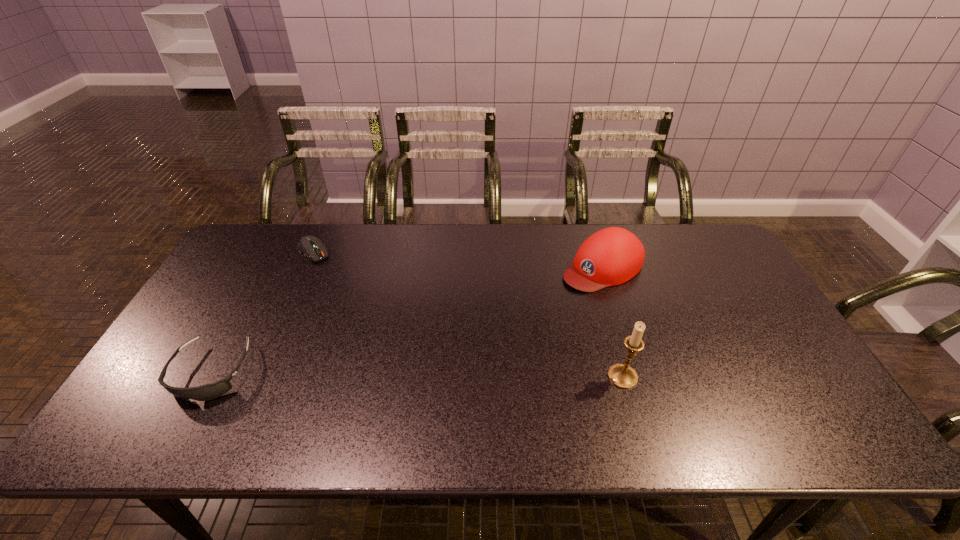
Identify the location of free space at the right edge. The image size is (960, 540). (776, 323).

The width and height of the screenshot is (960, 540). I want to click on free location at the far left corner, so click(255, 258).

Identify the location of vacant space at the near left corner of the desktop. (202, 379).

You are a GUI agent. You are given a task and a screenshot of the screen. Output one action in this format:
    pyautogui.click(x=<x>, y=<y>)
    Task: Click on the vacant space at the far right corner
    The width and height of the screenshot is (960, 540).
    Given the screenshot: What is the action you would take?
    pyautogui.click(x=668, y=227)

You are a GUI agent. You are given a task and a screenshot of the screen. Output one action in this format:
    pyautogui.click(x=<x>, y=<y>)
    Task: Click on the unoccupied area between the third shortest object and the third tallest object
    This screenshot has width=960, height=540.
    Given the screenshot: What is the action you would take?
    pyautogui.click(x=407, y=319)

Locate an element on the screen. The height and width of the screenshot is (540, 960). blank region between the third shortest object and the second shortest object is located at coordinates (407, 319).

Locate an element on the screen. This screenshot has height=540, width=960. free space between the shortest object and the baseball cap is located at coordinates (458, 259).

Where is `vacant point located between the tallest object and the computer equipment`? vacant point located between the tallest object and the computer equipment is located at coordinates (468, 314).

Locate an element on the screen. This screenshot has width=960, height=540. free space between the second tallest object and the candle holder is located at coordinates (612, 322).

Where is `free space that is in between the tallest object and the computer equipment`? free space that is in between the tallest object and the computer equipment is located at coordinates (468, 314).